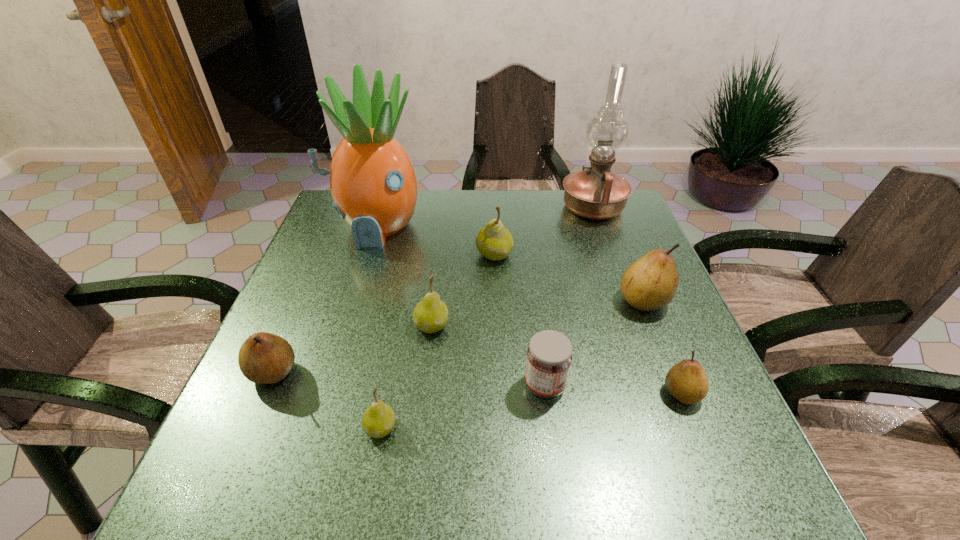
The image size is (960, 540). Find the location of `free space at the left edge of the desktop`. free space at the left edge of the desktop is located at coordinates (323, 400).

At what (x,y) coordinates should I click in order to perform the action: click on vacant space at the right edge of the desktop. Please return your answer as a coordinate pair (x, y). Looking at the image, I should click on click(x=612, y=269).

This screenshot has width=960, height=540. Find the location of `free region at the far right corner of the desktop`. free region at the far right corner of the desktop is located at coordinates 608,231.

The width and height of the screenshot is (960, 540). I want to click on blank space at the near right corner of the desktop, so click(710, 463).

Identify the location of free space that is in between the farthest green pear and the oil lamp. (543, 231).

You are a GUI agent. You are given a task and a screenshot of the screen. Output one action in this format:
    pyautogui.click(x=<x>, y=<y>)
    Task: Click on the free space between the nearest green pear and the jam
    
    Given the screenshot: What is the action you would take?
    pyautogui.click(x=463, y=406)

The width and height of the screenshot is (960, 540). In order to click on free space between the third pear from right to left and the smallest brown pear in this screenshot , I will do point(588,324).

Where is `vacant space that's between the oil lamp and the nearest object`? This screenshot has width=960, height=540. vacant space that's between the oil lamp and the nearest object is located at coordinates 487,318.

Locate an element on the screen. free space between the pineapple and the fifth pear from right to left is located at coordinates (378, 327).

Where is `unoccupied area between the leftmost pear and the pineapple`? The width and height of the screenshot is (960, 540). unoccupied area between the leftmost pear and the pineapple is located at coordinates (324, 299).